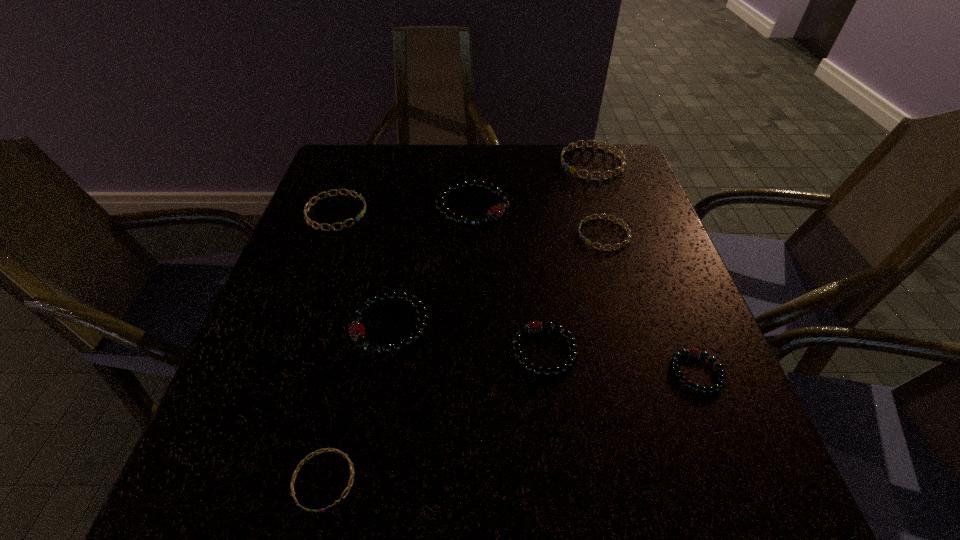
This screenshot has width=960, height=540. Find the location of `vacant space situated on the surface of the third biggest blue bracelet showing star-shaped elements`. vacant space situated on the surface of the third biggest blue bracelet showing star-shaped elements is located at coordinates (548, 234).

Where is `vacant region located 0.250m on the surface of the third biggest blue bracelet showing star-shaped elements`? vacant region located 0.250m on the surface of the third biggest blue bracelet showing star-shaped elements is located at coordinates (471, 234).

Image resolution: width=960 pixels, height=540 pixels. I want to click on vacant position located on the back of the rightmost black bracelet, so click(x=653, y=260).

What are the coordinates of `object that is at the near edge` in the screenshot? It's located at (298, 468).

The width and height of the screenshot is (960, 540). Identify the location of object present at the near left corner. (298, 468).

Find the location of `object at the far right corner`. object at the far right corner is located at coordinates (622, 157).

Identify the location of free location at the far edge. The width and height of the screenshot is (960, 540). (430, 150).

Locate an element on the screen. vacant space at the near edge of the desktop is located at coordinates (372, 464).

Identify the location of vacant space at the left edge of the desktop. The image size is (960, 540). (347, 230).

Locate an element on the screen. vacant space at the right edge of the desktop is located at coordinates (716, 398).